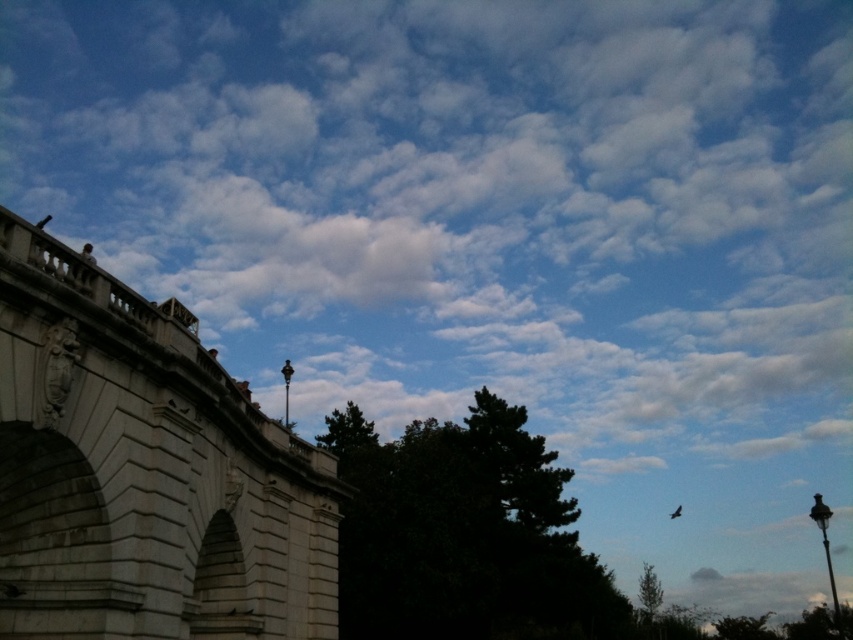
You are an artist planning to sketch this scene. You want to ensure that the white stone bridge at left and the dark green leafy tree at center are proportionally accurate. Which object should you draw larger on your paper?

The dark green leafy tree at center should be drawn larger because it occupies more space than the white stone bridge at left in the scene.

In the scene shown: You are standing at point (144, 472) in the image. What object are you standing on?

You are standing on the white stone bridge at left.